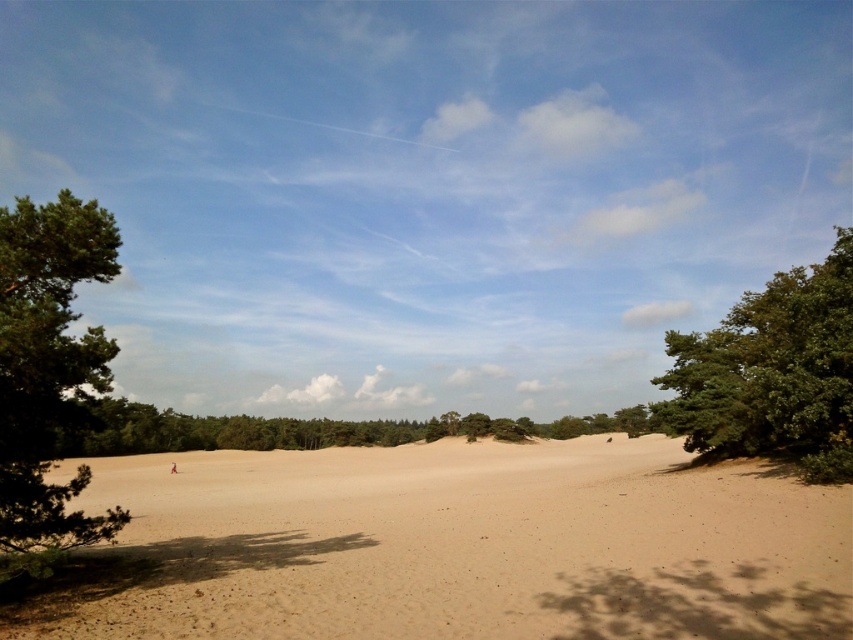
You are planning to build a small cabin in the beige sandy dunes at center. Considering the height of the green leafy tree at right, will the tree block the view of the sky from the cabin?

The beige sandy dunes at center is shorter than the green leafy tree at right, so the tree will block the view of the sky from the cabin.

You are standing at the point with coordinates point (657, 410) and want to walk towards the point with coordinates point (71, 440). Which direction should you move relative to the other point?

You should move towards the point (71, 440), which is behind point (657, 410) since point (657, 410) is in front of it.